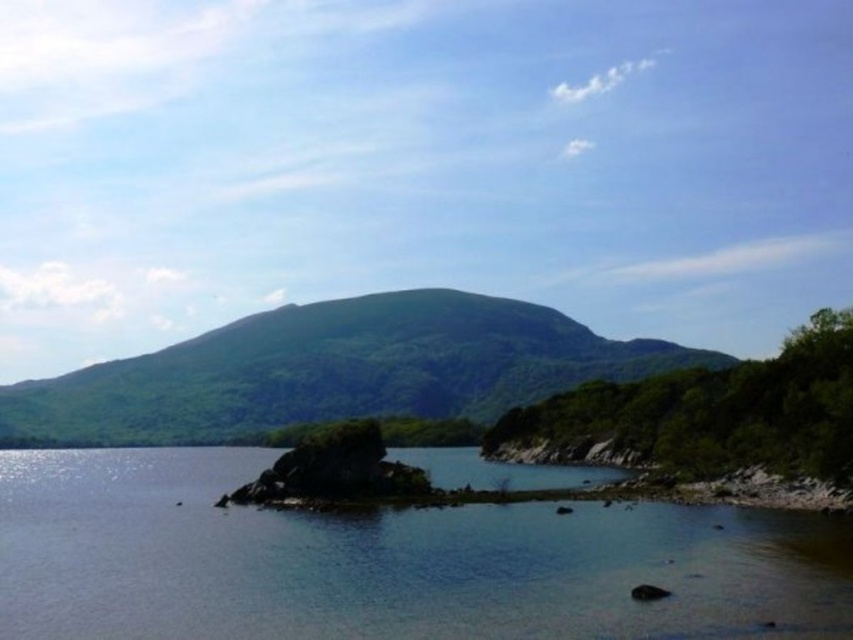
Does clear water at center have a smaller size compared to green leafy mountain at center?

Yes, clear water at center is smaller than green leafy mountain at center.

What do you see at coordinates (387, 561) in the screenshot?
I see `clear water at center` at bounding box center [387, 561].

Which is behind, point (751, 540) or point (550, 362)?

The point (550, 362) is behind.

Find the location of `clear water at center`. clear water at center is located at coordinates (387, 561).